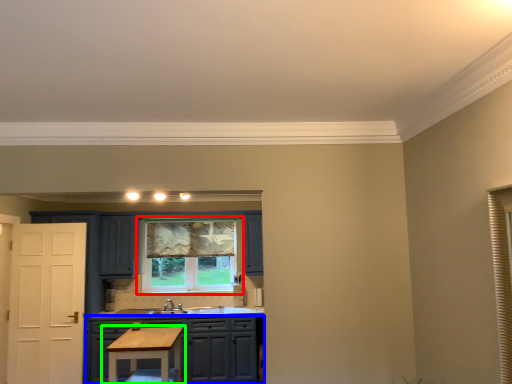
Question: Based on their relative distances, which object is farther from window (highlighted by a red box)? Choose from cabinetry (highlighted by a blue box) and table (highlighted by a green box).

Choices:
 (A) cabinetry
 (B) table

Answer: (B)